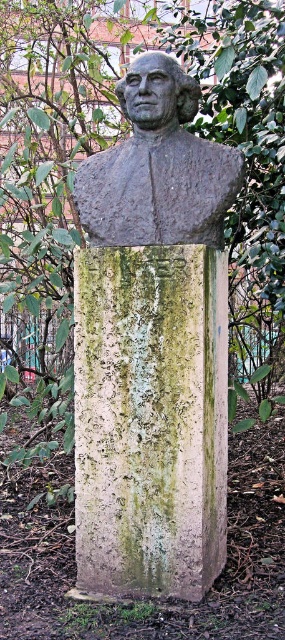
Does green mossy stone pillar at center appear on the right side of gray stone bust at center?

No, green mossy stone pillar at center is not to the right of gray stone bust at center.

Is green mossy stone pillar at center bigger than gray stone bust at center?

Correct, green mossy stone pillar at center is larger in size than gray stone bust at center.

Is point (117, 506) closer to viewer compared to point (159, 141)?

That is True.

What are the coordinates of `green mossy stone pillar at center` in the screenshot? It's located at (149, 419).